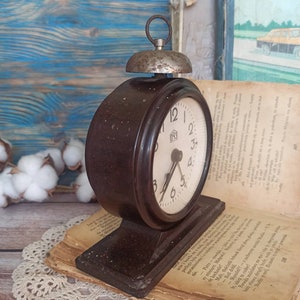
At what (x,y) coordinates should I click in order to perform the action: click on plant. Please return your answer as a coordinate pair (x, y). Image resolution: width=300 pixels, height=300 pixels. Looking at the image, I should click on (38, 176).